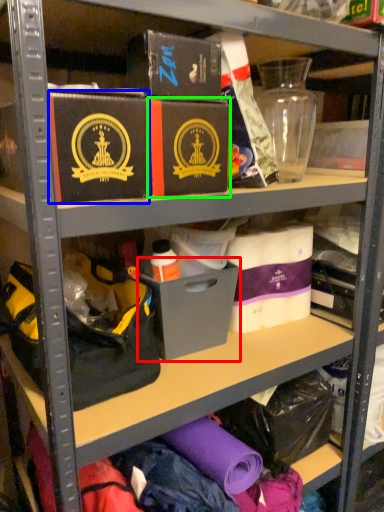
Question: Based on their relative distances, which object is nearer to storage box (highlighted by a red box)? Choose from box (highlighted by a blue box) and box (highlighted by a green box).

Choices:
 (A) box
 (B) box

Answer: (B)